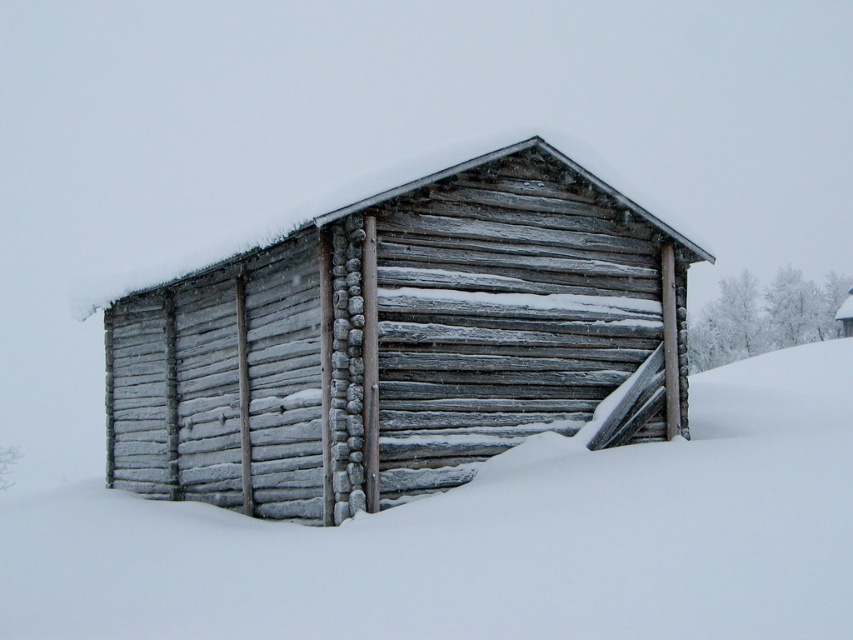
Does gray wooden cabin at center have a smaller size compared to white frosty snow at center?

Indeed, gray wooden cabin at center has a smaller size compared to white frosty snow at center.

Who is more forward, [120,312] or [474,515]?

Point [474,515] is in front.

Is point (680, 376) farther from camera compared to point (338, 577)?

Yes, point (680, 376) is behind point (338, 577).

The width and height of the screenshot is (853, 640). Identify the location of gray wooden cabin at center. (403, 342).